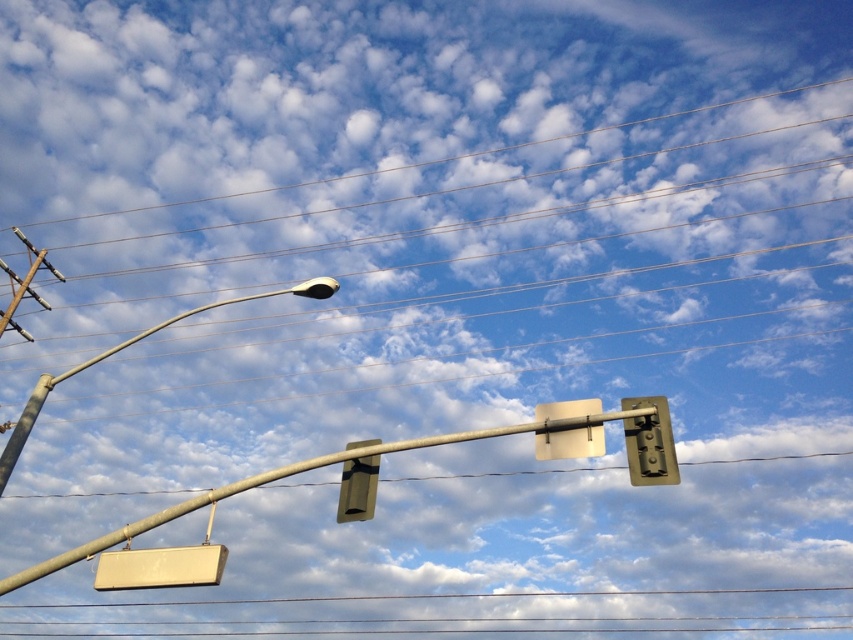
Between point (154, 552) and point (630, 406), which one is positioned behind?

Point (154, 552)

Is white matte sign at lower left closer to the viewer compared to metallic gold traffic light at upper right?

No, white matte sign at lower left is further to the viewer.

Who is more forward, [181,554] or [647,458]?

Positioned in front is point [647,458].

Where is `white matte sign at lower left`? white matte sign at lower left is located at coordinates (160, 566).

Between white matte sign at lower left and sleek metallic street light at upper left, which one appears on the left side from the viewer's perspective?

→ sleek metallic street light at upper left is more to the left.

Who is shorter, white matte sign at lower left or sleek metallic street light at upper left?

white matte sign at lower left is shorter.

Locate an element on the screen. white matte sign at lower left is located at coordinates (160, 566).

Who is shorter, white matte sign at lower left or metallic silver traffic light at center?

white matte sign at lower left

The height and width of the screenshot is (640, 853). What do you see at coordinates (160, 566) in the screenshot?
I see `white matte sign at lower left` at bounding box center [160, 566].

You are a GUI agent. You are given a task and a screenshot of the screen. Output one action in this format:
    pyautogui.click(x=<x>, y=<y>)
    Task: Click on the white matte sign at lower left
    This screenshot has width=853, height=640.
    Given the screenshot: What is the action you would take?
    pyautogui.click(x=160, y=566)